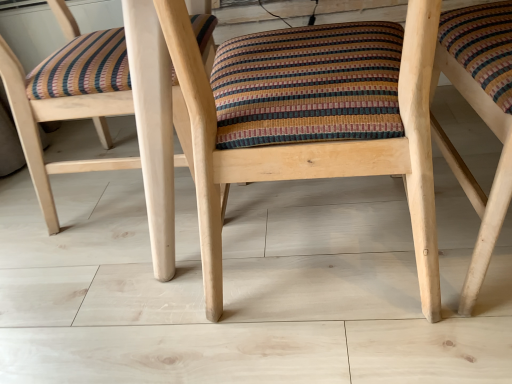
Question: Is there a large distance between natural wood chair at center, the 1th chair viewed from the right, and wooden chair at center, positioned as the 2th chair in right-to-left order?

Choices:
 (A) yes
 (B) no

Answer: (B)

Question: From the image's perspective, is natural wood chair at center, the 3th chair when ordered from left to right, over wooden chair at center, positioned as the 2th chair in right-to-left order?

Choices:
 (A) yes
 (B) no

Answer: (A)

Question: Could you tell me if natural wood chair at center, the 3th chair when ordered from left to right, is turned towards wooden chair at center, positioned as the 2th chair in right-to-left order?

Choices:
 (A) yes
 (B) no

Answer: (B)

Question: Can you confirm if natural wood chair at center, the 3th chair when ordered from left to right, is shorter than wooden chair at center, which appears as the 2th chair when viewed from the left?

Choices:
 (A) no
 (B) yes

Answer: (B)

Question: Can you confirm if natural wood chair at center, the 3th chair when ordered from left to right, is wider than wooden chair at center, positioned as the 2th chair in right-to-left order?

Choices:
 (A) no
 (B) yes

Answer: (A)

Question: From the image's perspective, is natural wood chair at center, the 3th chair when ordered from left to right, located beneath wooden chair at center, positioned as the 2th chair in right-to-left order?

Choices:
 (A) no
 (B) yes

Answer: (A)

Question: Is natural wood chair at center, the 3th chair when ordered from left to right, thinner than wooden chair at center, marked as the first chair in a left-to-right arrangement?

Choices:
 (A) no
 (B) yes

Answer: (A)

Question: Can you confirm if natural wood chair at center, the 1th chair viewed from the right, is wider than wooden chair at center, marked as the first chair in a left-to-right arrangement?

Choices:
 (A) yes
 (B) no

Answer: (A)

Question: Could wooden chair at center, marked as the first chair in a left-to-right arrangement, be considered to be inside natural wood chair at center, the 1th chair viewed from the right?

Choices:
 (A) yes
 (B) no

Answer: (B)

Question: Would you say natural wood chair at center, the 1th chair viewed from the right, is outside wooden chair at center, marked as the first chair in a left-to-right arrangement?

Choices:
 (A) yes
 (B) no

Answer: (A)

Question: Does natural wood chair at center, the 3th chair when ordered from left to right, lie in front of wooden chair at center, positioned as the 3th chair in right-to-left order?

Choices:
 (A) yes
 (B) no

Answer: (A)

Question: From the image's perspective, would you say wooden chair at center, positioned as the 3th chair in right-to-left order, is shown under natural wood chair at center, the 1th chair viewed from the right?

Choices:
 (A) yes
 (B) no

Answer: (B)